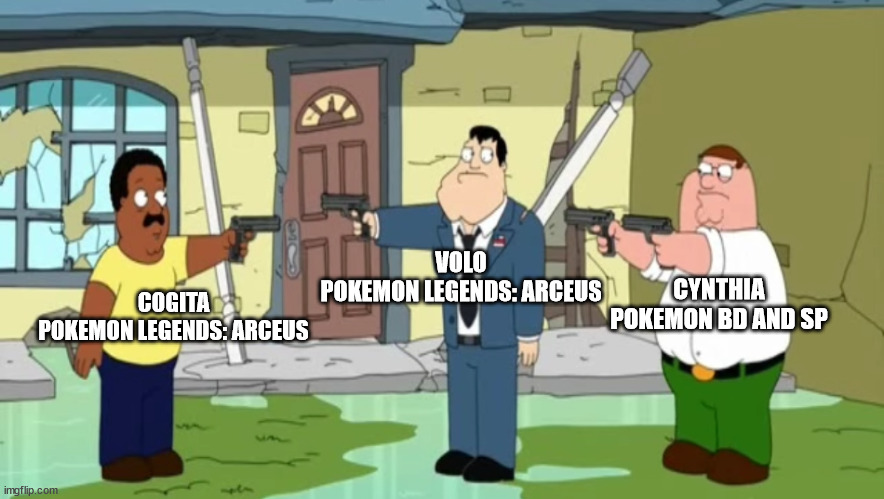
At what (x,y) coordinates should I click in order to perform the action: click on window. Please return your answer as a coordinate pair (x, y). The width and height of the screenshot is (884, 499). Looking at the image, I should click on (96, 151).